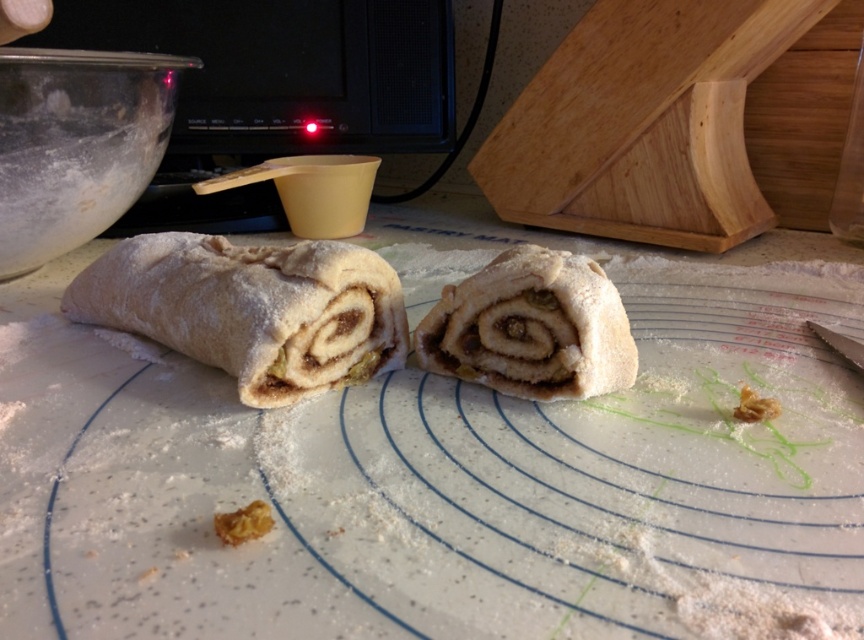
Is cinnamon-sugar pastry at center positioned before yellow crumbly pastry at center?

No.

Which is in front, point (531, 307) or point (271, 520)?

Point (271, 520)

Find the location of a particular element. cinnamon-sugar pastry at center is located at coordinates [x=531, y=326].

Is powdered white dough at center to the right of yellow crumbly pastry at center from the viewer's perspective?

Correct, you'll find powdered white dough at center to the right of yellow crumbly pastry at center.

Where is `powdered white dough at center`? The width and height of the screenshot is (864, 640). powdered white dough at center is located at coordinates (450, 477).

Find the location of a particular element. powdered white dough at center is located at coordinates (450, 477).

Which of these two, powdery white dough at center or yellow crumbly pastry at center, stands taller?

Standing taller between the two is powdery white dough at center.

This screenshot has height=640, width=864. What are the coordinates of `powdery white dough at center` in the screenshot? It's located at (251, 308).

Does point (350, 244) lie behind point (229, 529)?

Yes, point (350, 244) is farther from viewer.

The image size is (864, 640). I want to click on powdery white dough at center, so click(x=251, y=308).